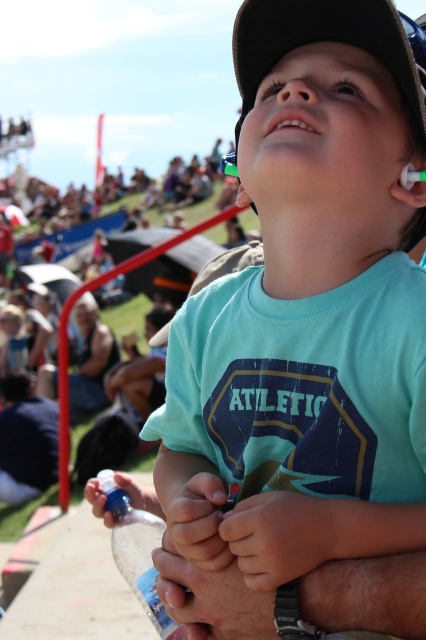
Question: Which object is positioned closest to the dark blue shirt at lower left?

Choices:
 (A) clear plastic bottle at lower center
 (B) light blue cotton shirt at center
 (C) bright white teeth at center
 (D) matte red metal railing at left

Answer: (D)

Question: Is light blue cotton shirt at center further to the viewer compared to dark blue shirt at lower left?

Choices:
 (A) yes
 (B) no

Answer: (B)

Question: Which of the following is the closest to the observer?

Choices:
 (A) dark blue shirt at lower left
 (B) light blue cotton shirt at center
 (C) matte red metal railing at left
 (D) bright white teeth at center

Answer: (B)

Question: Does dark blue shirt at lower left have a larger size compared to matte red metal railing at left?

Choices:
 (A) no
 (B) yes

Answer: (A)

Question: Based on their relative distances, which object is farther from the bright white teeth at center?

Choices:
 (A) dark blue shirt at lower left
 (B) light blue cotton shirt at center
 (C) clear plastic bottle at lower center
 (D) matte red metal railing at left

Answer: (D)

Question: From the image, what is the correct spatial relationship of dark blue shirt at lower left in relation to clear plastic bottle at lower center?

Choices:
 (A) left
 (B) right

Answer: (A)